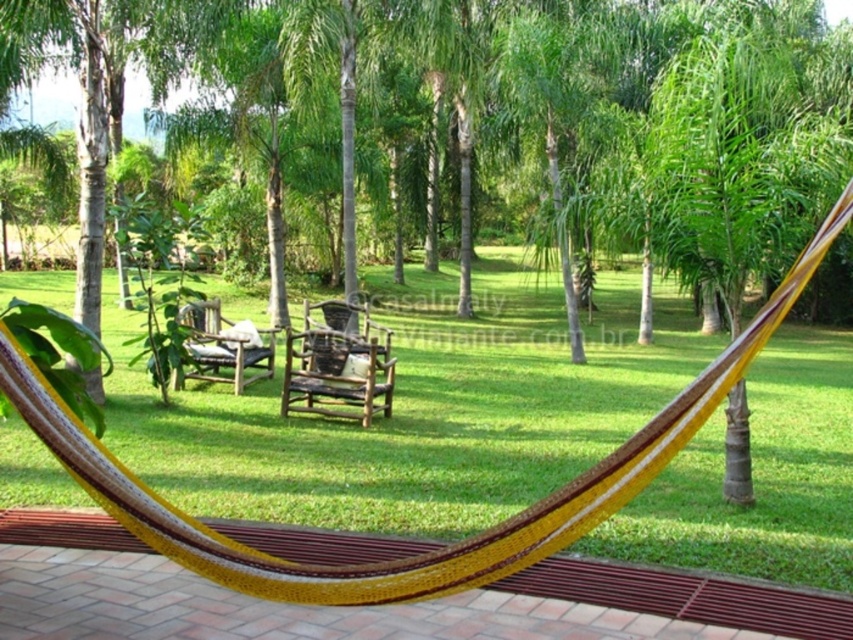
Does brown woven park bench at center have a greater height compared to wooden park bench at center?

No.

Can you confirm if brown woven park bench at center is positioned to the right of wooden park bench at center?

Indeed, brown woven park bench at center is positioned on the right side of wooden park bench at center.

Find the location of a particular element. The width and height of the screenshot is (853, 640). brown woven park bench at center is located at coordinates (337, 365).